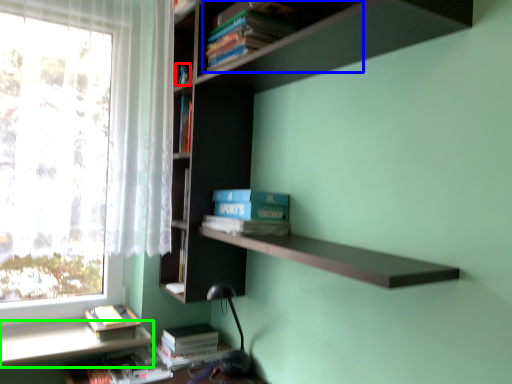
Question: Which is farther away from book (highlighted by a red box)? book (highlighted by a blue box) or window sill (highlighted by a green box)?

Choices:
 (A) book
 (B) window sill

Answer: (B)